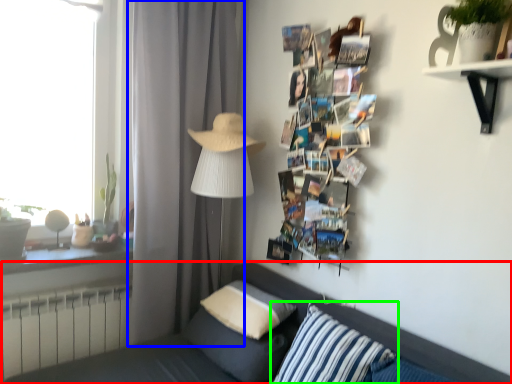
Question: Based on their relative distances, which object is farther from studio couch (highlighted by a red box)? Choose from curtain (highlighted by a blue box) and pillow (highlighted by a green box).

Choices:
 (A) curtain
 (B) pillow

Answer: (A)